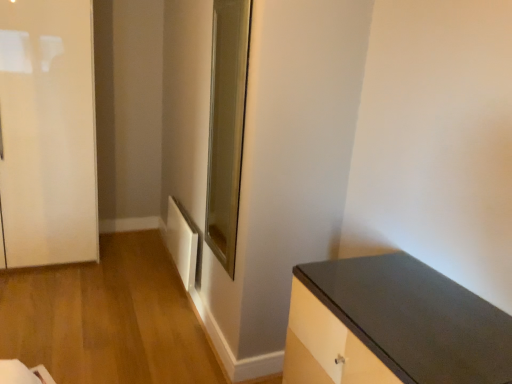
Question: Is clear glass door at center positioned before matte black countertop at lower right?

Choices:
 (A) yes
 (B) no

Answer: (B)

Question: Does clear glass door at center appear on the right side of matte black countertop at lower right?

Choices:
 (A) yes
 (B) no

Answer: (B)

Question: Considering the relative sizes of clear glass door at center and matte black countertop at lower right in the image provided, is clear glass door at center thinner than matte black countertop at lower right?

Choices:
 (A) yes
 (B) no

Answer: (A)

Question: Considering the relative sizes of clear glass door at center and matte black countertop at lower right in the image provided, is clear glass door at center shorter than matte black countertop at lower right?

Choices:
 (A) no
 (B) yes

Answer: (A)

Question: Does clear glass door at center turn towards matte black countertop at lower right?

Choices:
 (A) no
 (B) yes

Answer: (A)

Question: From a real-world perspective, relative to clear glass door at center, is white matte radiator at lower left vertically above or below?

Choices:
 (A) below
 (B) above

Answer: (A)

Question: Considering the positions of point (182, 264) and point (224, 238), is point (182, 264) closer or farther from the camera than point (224, 238)?

Choices:
 (A) farther
 (B) closer

Answer: (A)

Question: Is white matte radiator at lower left situated inside clear glass door at center or outside?

Choices:
 (A) outside
 (B) inside

Answer: (A)

Question: Considering the positions of white matte radiator at lower left and clear glass door at center in the image, is white matte radiator at lower left taller or shorter than clear glass door at center?

Choices:
 (A) short
 (B) tall

Answer: (A)

Question: From a real-world perspective, is white matte radiator at lower left physically located above or below white glossy door at left?

Choices:
 (A) above
 (B) below

Answer: (B)

Question: Is white matte radiator at lower left bigger or smaller than white glossy door at left?

Choices:
 (A) big
 (B) small

Answer: (B)

Question: Does point (188, 248) appear closer or farther from the camera than point (10, 34)?

Choices:
 (A) farther
 (B) closer

Answer: (A)

Question: Is white matte radiator at lower left wider or thinner than white glossy door at left?

Choices:
 (A) wide
 (B) thin

Answer: (B)

Question: From a real-world perspective, is matte black countertop at lower right positioned above or below clear glass door at center?

Choices:
 (A) above
 (B) below

Answer: (B)

Question: Looking at their shapes, would you say matte black countertop at lower right is wider or thinner than clear glass door at center?

Choices:
 (A) thin
 (B) wide

Answer: (B)